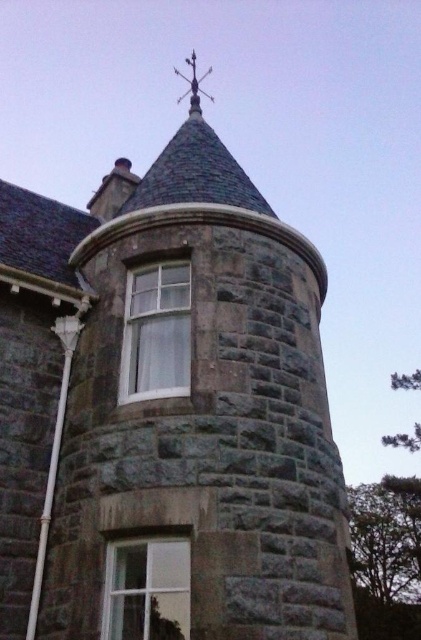
Can you confirm if white glass window at center is shorter than clear glass window at center?

No.

Does point (138, 364) come farther from viewer compared to point (173, 556)?

Yes.

Measure the distance between white glass window at center and camera.

A distance of 11.15 meters exists between white glass window at center and camera.

This screenshot has height=640, width=421. I want to click on white glass window at center, so click(157, 332).